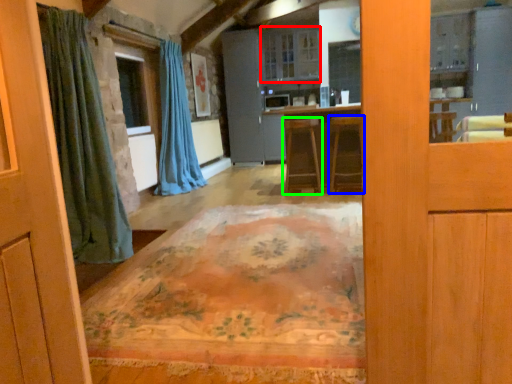
Question: Estimate the real-world distances between objects in this image. Which object is farther from cabinetry (highlighted by a red box), furniture (highlighted by a blue box) or furniture (highlighted by a green box)?

Choices:
 (A) furniture
 (B) furniture

Answer: (A)